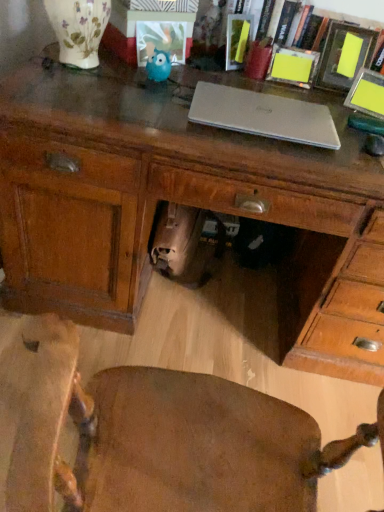
Identify the location of free space in front of matte plastic picture frame at center, marked as the fourth picture frame in a right-to-left arrangement. (124, 82).